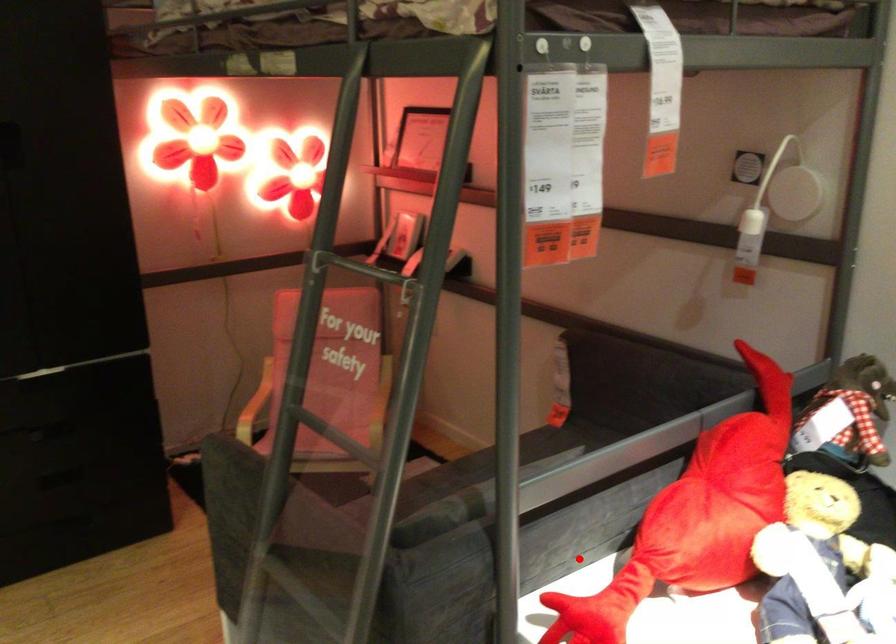
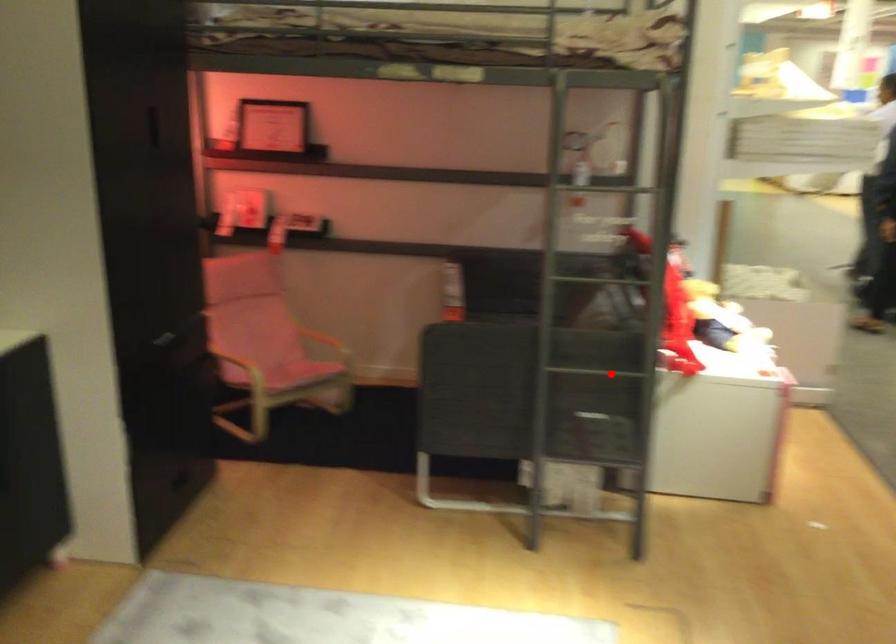
I am providing you with two images of the same scene from different viewpoints. A red point is marked on the first image and another point is marked on the second image. Does the point marked in image1 correspond to the same location as the one in image2?

No